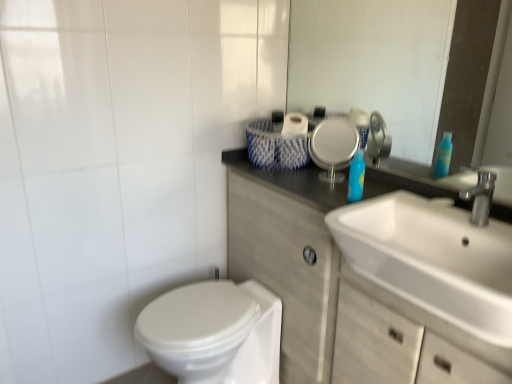
Question: In terms of height, does blue glossy bottle at upper right look taller or shorter compared to white glossy bidet at lower left?

Choices:
 (A) tall
 (B) short

Answer: (B)

Question: Is blue glossy bottle at upper right bigger or smaller than white glossy bidet at lower left?

Choices:
 (A) small
 (B) big

Answer: (A)

Question: Estimate the real-world distances between objects in this image. Which object is closer to the white matte cabinet at center?

Choices:
 (A) white glossy sink at right
 (B) white woven basket at upper center
 (C) glossy glass mirror at upper center
 (D) white glossy bidet at lower left
 (E) blue glossy bottle at upper right

Answer: (A)

Question: Which object is positioned closest to the white woven basket at upper center?

Choices:
 (A) white matte cabinet at center
 (B) blue glossy bottle at upper right
 (C) white glossy bidet at lower left
 (D) glossy glass mirror at upper center
 (E) white glossy sink at right

Answer: (B)